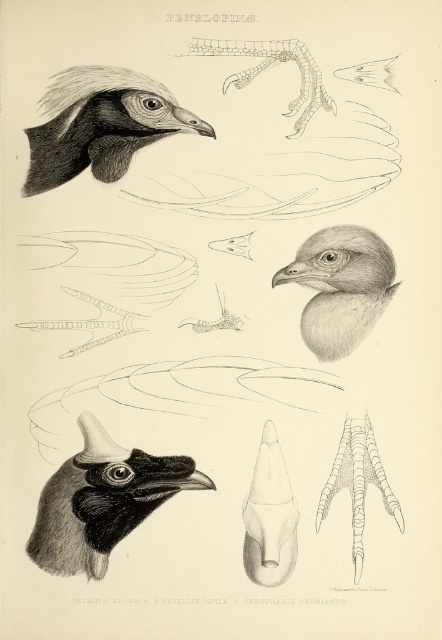
Is black matte head at lower left positioned before smooth gray head at center?

Yes.

Who is taller, black matte head at lower left or smooth gray head at center?

black matte head at lower left

This screenshot has width=442, height=640. In order to click on black matte head at lower left in this screenshot , I will do `click(102, 500)`.

Find the location of a particular element. This screenshot has width=442, height=640. black matte head at lower left is located at coordinates (102, 500).

Does smooth black head at upper left have a smaller size compared to smooth gray head at center?

No.

Does point (99, 108) come in front of point (357, 340)?

Yes, point (99, 108) is closer to viewer.

This screenshot has height=640, width=442. In order to click on smooth black head at upper left in this screenshot , I will do `click(101, 124)`.

Between point (99, 460) and point (114, 76), which one is positioned in front?

Point (114, 76) is more forward.

Is point (80, 566) more distant than point (91, 118)?

No, (80, 566) is in front of (91, 118).

The width and height of the screenshot is (442, 640). Identify the location of black matte head at lower left. tap(102, 500).